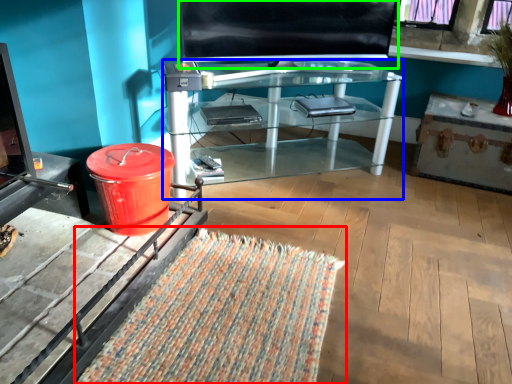
Question: Which object is positioned farthest from mat (highlighted by a red box)? Select from desk (highlighted by a blue box) and screen (highlighted by a green box).

Choices:
 (A) desk
 (B) screen

Answer: (B)